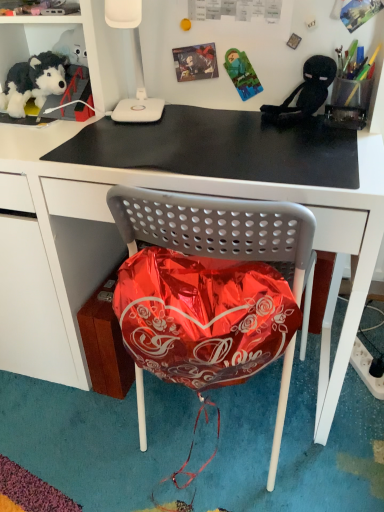
Find the location of `free location in front of white plastic power outlet at lower right`. free location in front of white plastic power outlet at lower right is located at coordinates (358, 418).